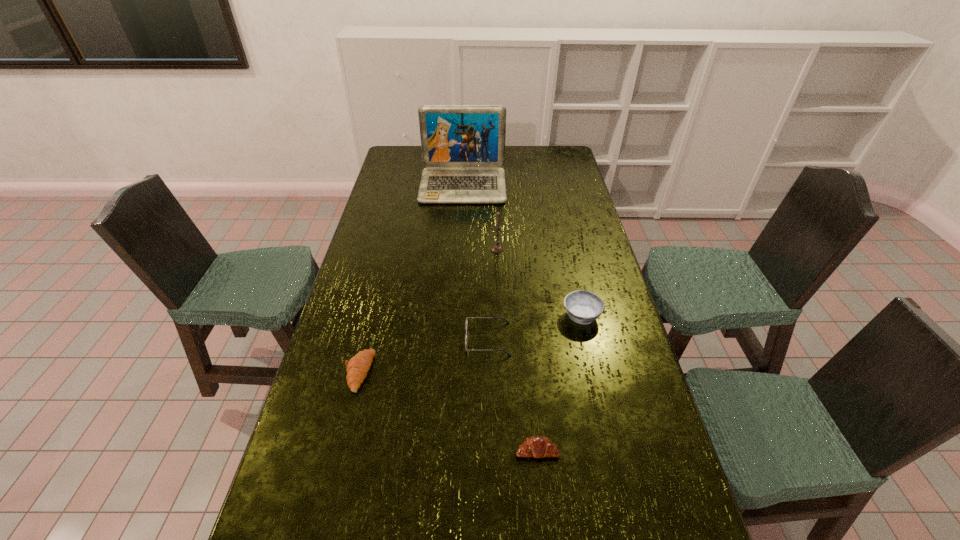
You are a GUI agent. You are given a task and a screenshot of the screen. Output one action in this format:
    pyautogui.click(x=<x>, y=<y>)
    Task: Click on the vacant region between the sunglasses and the tallest object
    
    Given the screenshot: What is the action you would take?
    pyautogui.click(x=475, y=262)

You are a GUI agent. You are given a task and a screenshot of the screen. Output one action in this format:
    pyautogui.click(x=<x>, y=<y>)
    Task: Click on the vacant space that's between the fifth shortest object and the shortest object
    Image resolution: width=960 pixels, height=540 pixels.
    Given the screenshot: What is the action you would take?
    pyautogui.click(x=517, y=349)

The height and width of the screenshot is (540, 960). In order to click on free spot between the rightmost object and the candle in this screenshot , I will do `click(540, 282)`.

This screenshot has height=540, width=960. Find the location of `vacant space that's between the leftmost object and the candle`. vacant space that's between the leftmost object and the candle is located at coordinates (428, 310).

Select which object appears as the third closest to the sunglasses. Please provide its 2D coordinates. Your answer should be formatted as a tuple, i.e. [(x, y)], where the tuple contains the x and y coordinates of a point satisfying the conditions above.

[(357, 368)]

The image size is (960, 540). I want to click on the fourth closest object relative to the fifth nearest object, so click(357, 368).

You are a GUI agent. You are given a task and a screenshot of the screen. Output one action in this format:
    pyautogui.click(x=<x>, y=<y>)
    Task: Click on the free space that satisfies the following two spatial constraints: 1. on the screen of the laptop computer; 2. on the left side of the fifth nearest object
    
    Given the screenshot: What is the action you would take?
    pyautogui.click(x=460, y=249)

Image resolution: width=960 pixels, height=540 pixels. Find the location of `vacant space that satisfies the following two spatial constraints: 1. on the front side of the nearest object; 2. on the right side of the farther crescent roll`. vacant space that satisfies the following two spatial constraints: 1. on the front side of the nearest object; 2. on the right side of the farther crescent roll is located at coordinates (340, 450).

At what (x,y) coordinates should I click in order to perform the action: click on vacant space that satisfies the following two spatial constraints: 1. on the front side of the second farthest object; 2. on the right side of the shortest object. Please return your answer as a coordinate pair (x, y). Looking at the image, I should click on pos(506,450).